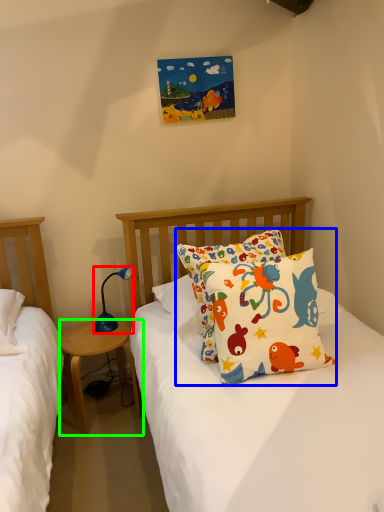
Question: Which object is the farthest from lamp (highlighted by a red box)? Choose among these: pillow (highlighted by a blue box) or nightstand (highlighted by a green box).

Choices:
 (A) pillow
 (B) nightstand

Answer: (A)